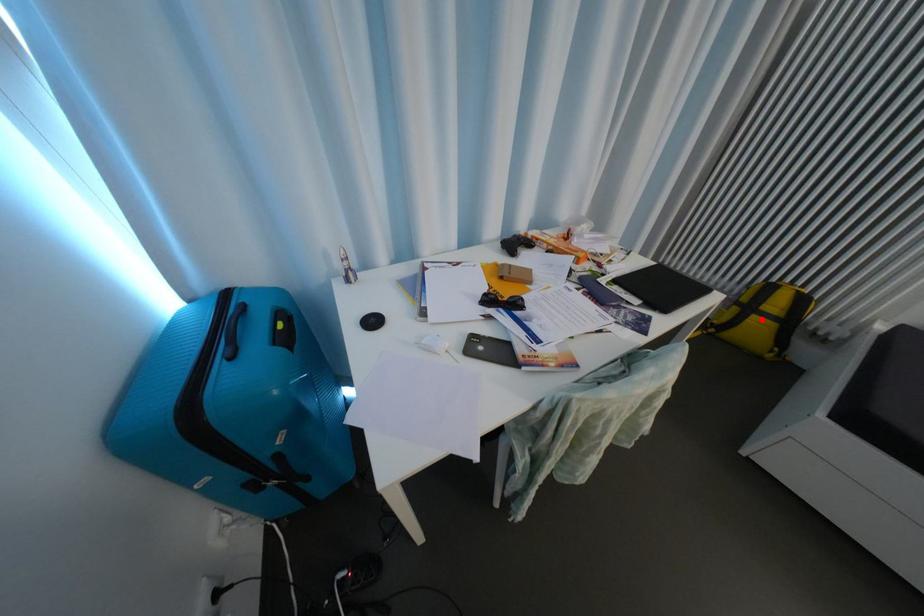
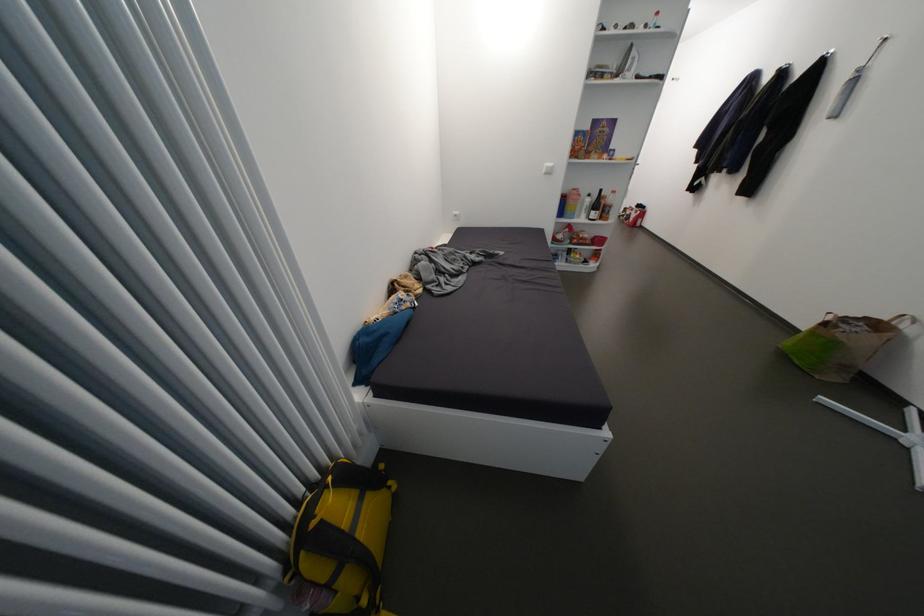
Where in the second image is the point corresponding to the highlighted location from the first image?

(370, 533)